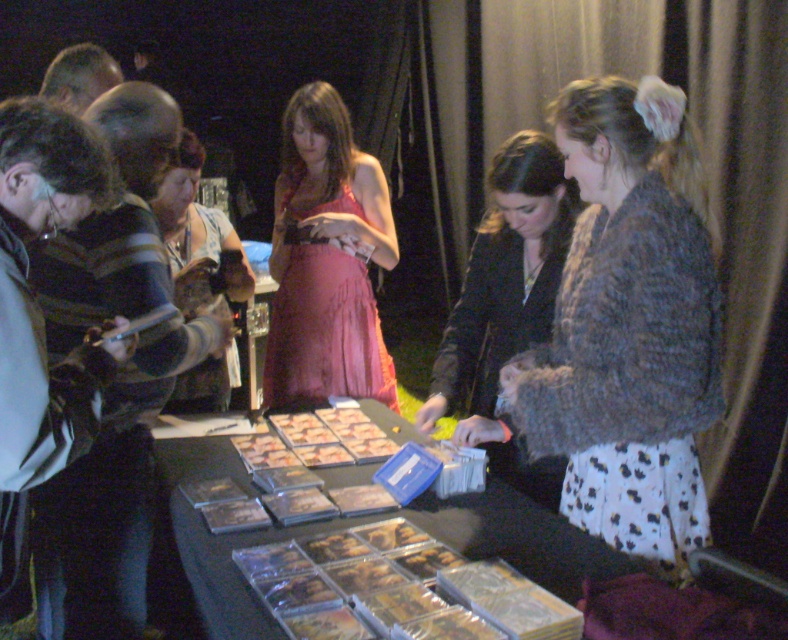
Can you confirm if clear plastic cases at center is positioned above golden crispy chicken at center?

Actually, clear plastic cases at center is below golden crispy chicken at center.

Is clear plastic cases at center to the left of golden crispy chicken at center from the viewer's perspective?

In fact, clear plastic cases at center is to the right of golden crispy chicken at center.

You are a GUI agent. You are given a task and a screenshot of the screen. Output one action in this format:
    pyautogui.click(x=<x>, y=<y>)
    Task: Click on the clear plastic cases at center
    The height and width of the screenshot is (640, 788).
    Given the screenshot: What is the action you would take?
    pyautogui.click(x=225, y=540)

The height and width of the screenshot is (640, 788). Identify the location of clear plastic cases at center. (225, 540).

Can you confirm if matte brown purse at center is bigger than golden brown pastry at center?

Yes.

Which is more to the right, matte brown purse at center or golden brown pastry at center?

golden brown pastry at center is more to the right.

The width and height of the screenshot is (788, 640). I want to click on matte brown purse at center, so (x=199, y=228).

This screenshot has width=788, height=640. Identify the location of matte brown purse at center. (199, 228).

Measure the distance between point (316, 243) and camera.

The distance of point (316, 243) from camera is 2.76 meters.

Can you confirm if pink satin dress at center is positioned below clear plastic cases at center?

Incorrect, pink satin dress at center is not positioned below clear plastic cases at center.

Locate an element on the screen. pink satin dress at center is located at coordinates (326, 260).